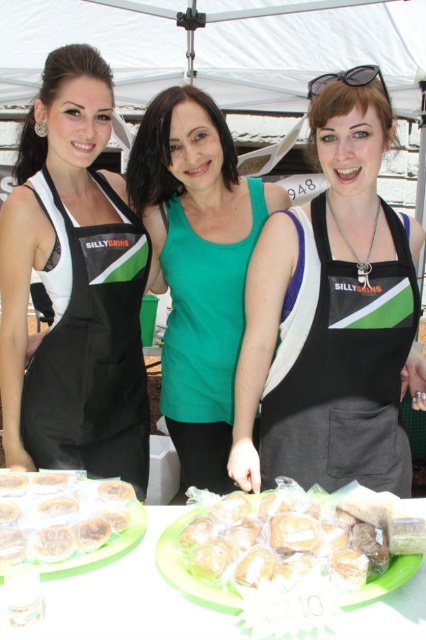
Question: Among these points, which one is nearest to the camera?

Choices:
 (A) (106, 369)
 (B) (118, 492)

Answer: (B)

Question: Does black fabric apron at center come behind black plastic sunglasses at upper center?

Choices:
 (A) yes
 (B) no

Answer: (A)

Question: Does black fabric apron at center appear over translucent plastic muffins at lower left?

Choices:
 (A) yes
 (B) no

Answer: (A)

Question: Is translucent plastic muffins at lower left further to camera compared to golden brown pastry at center?

Choices:
 (A) no
 (B) yes

Answer: (B)

Question: Which point is closer to the camera?

Choices:
 (A) green fabric tank top at center
 (B) black plastic sunglasses at upper center
 (C) black fabric apron at center
 (D) translucent plastic muffins at lower left

Answer: (D)

Question: Which of the following is the farthest from the observer?

Choices:
 (A) (150, 556)
 (B) (391, 296)
 (C) (189, 333)
 (D) (138, 316)

Answer: (D)